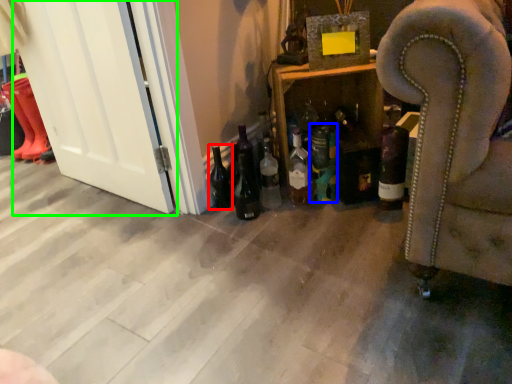
Question: Considering the real-world distances, which object is farthest from beer bottle (highlighted by a red box)? bottle (highlighted by a blue box) or screen door (highlighted by a green box)?

Choices:
 (A) bottle
 (B) screen door

Answer: (B)